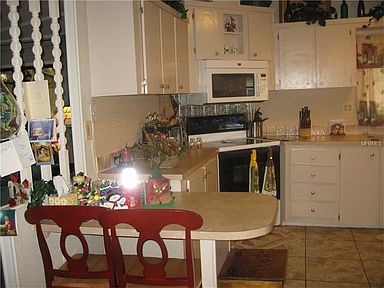
This screenshot has width=384, height=288. Find the location of `indoor potplant`. indoor potplant is located at coordinates (300, 12).